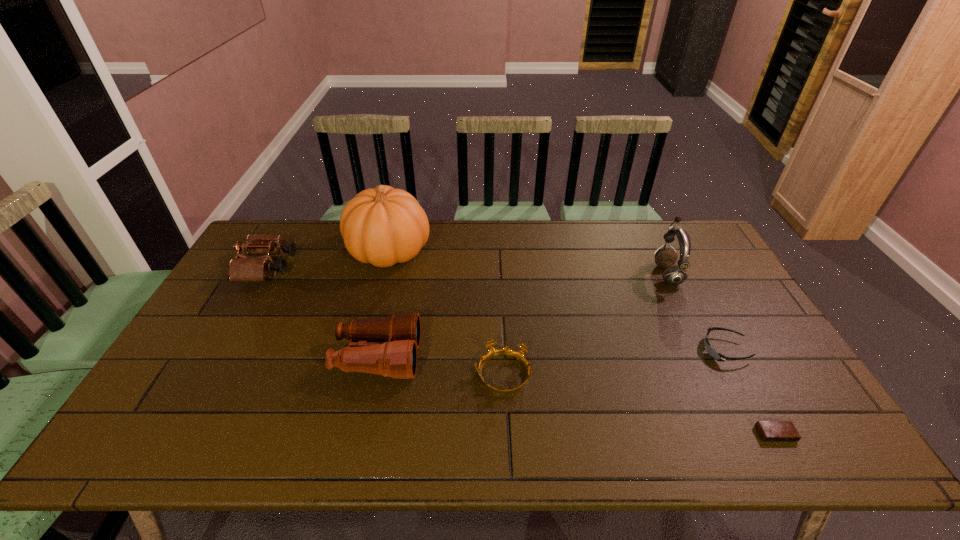
The image size is (960, 540). Identify the location of vacant space located on the left of the tallest object. (312, 252).

Where is `free region located 0.120m on the ear pads of the earphone`? free region located 0.120m on the ear pads of the earphone is located at coordinates (618, 274).

At what (x,y) coordinates should I click in order to perform the action: click on vacant position located on the ear pads of the earphone. Please return your answer as a coordinate pair (x, y). Looking at the image, I should click on (566, 274).

Where is `free location located on the ear pads of the earphone`? This screenshot has width=960, height=540. free location located on the ear pads of the earphone is located at coordinates (634, 274).

This screenshot has height=540, width=960. I want to click on vacant area located 0.330m through the eyepieces of the leftmost object, so click(392, 268).

You are a GUI agent. You are given a task and a screenshot of the screen. Output one action in this format:
    pyautogui.click(x=<x>, y=<y>)
    Task: Click on the free space located through the lenses of the nearer binoculars
    The image size is (960, 540).
    Given the screenshot: What is the action you would take?
    pyautogui.click(x=527, y=357)

Locate an element on the screen. Image resolution: width=960 pixels, height=540 pixels. vacant region located on the left of the crown is located at coordinates (330, 375).

Where is `vacant area situated 0.090m on the lenses of the sunglasses`? vacant area situated 0.090m on the lenses of the sunglasses is located at coordinates point(670,350).

Image resolution: width=960 pixels, height=540 pixels. I want to click on vacant area located 0.390m on the lenses of the sunglasses, so click(x=559, y=350).

Find the location of a particular element. This screenshot has width=960, height=540. blank space located 0.260m on the lenses of the sunglasses is located at coordinates (607, 350).